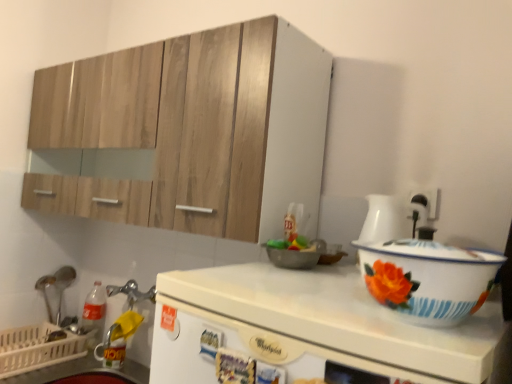
Question: Is the surface of brushed metal spoon at left in direct contact with white glossy whirlpool at center?

Choices:
 (A) yes
 (B) no

Answer: (B)

Question: Can you confirm if brushed metal spoon at left is positioned to the right of white glossy whirlpool at center?

Choices:
 (A) no
 (B) yes

Answer: (A)

Question: Does brushed metal spoon at left have a smaller size compared to white glossy whirlpool at center?

Choices:
 (A) no
 (B) yes

Answer: (B)

Question: Can we say brushed metal spoon at left lies outside white glossy whirlpool at center?

Choices:
 (A) yes
 (B) no

Answer: (A)

Question: From a real-world perspective, does brushed metal spoon at left sit lower than white glossy whirlpool at center?

Choices:
 (A) no
 (B) yes

Answer: (B)

Question: Considering the relative sizes of brushed metal spoon at left and white glossy whirlpool at center in the image provided, is brushed metal spoon at left bigger than white glossy whirlpool at center?

Choices:
 (A) no
 (B) yes

Answer: (A)

Question: Is white enamel basin at right positioned beyond the bounds of white glossy counter top at lower left?

Choices:
 (A) yes
 (B) no

Answer: (A)

Question: Is white enamel basin at right shorter than white glossy counter top at lower left?

Choices:
 (A) yes
 (B) no

Answer: (A)

Question: Are white enamel basin at right and white glossy counter top at lower left far apart?

Choices:
 (A) no
 (B) yes

Answer: (B)

Question: Is white enamel basin at right positioned before white glossy counter top at lower left?

Choices:
 (A) no
 (B) yes

Answer: (B)

Question: Considering the relative positions of white enamel basin at right and white glossy counter top at lower left in the image provided, is white enamel basin at right behind white glossy counter top at lower left?

Choices:
 (A) yes
 (B) no

Answer: (B)

Question: From the image's perspective, is white enamel basin at right beneath white glossy counter top at lower left?

Choices:
 (A) no
 (B) yes

Answer: (A)

Question: From the image's perspective, is brushed metal spoon at left located beneath white glossy counter top at lower left?

Choices:
 (A) yes
 (B) no

Answer: (B)